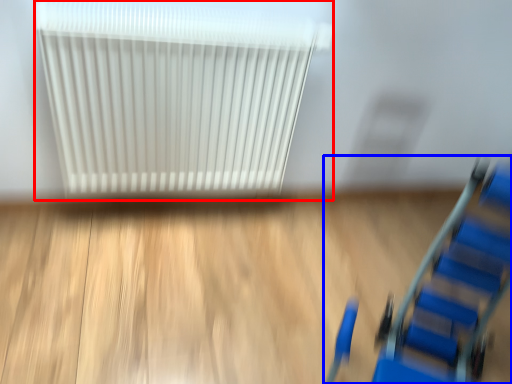
Question: Which object is further to the camera taking this photo, radiator (highlighted by a red box) or furniture (highlighted by a blue box)?

Choices:
 (A) radiator
 (B) furniture

Answer: (A)